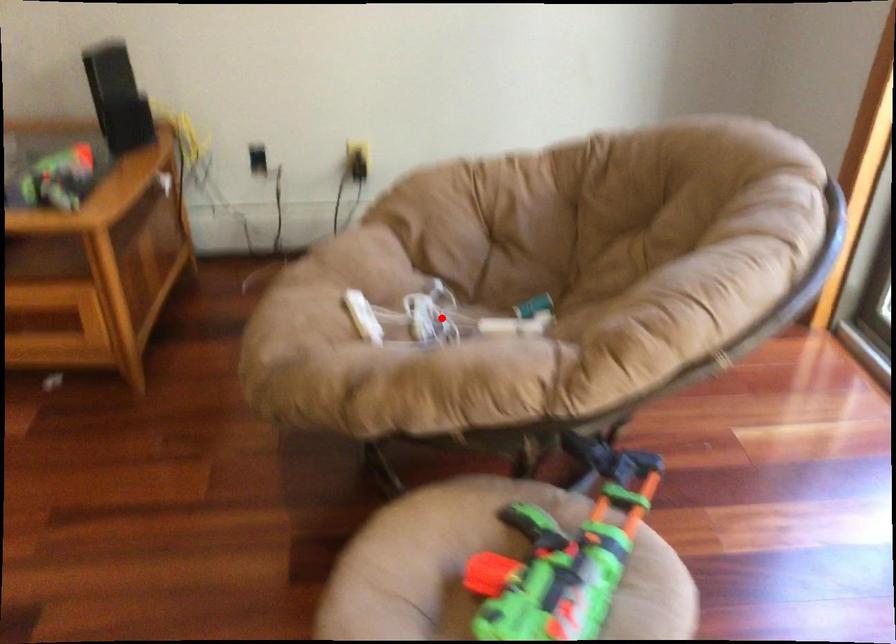
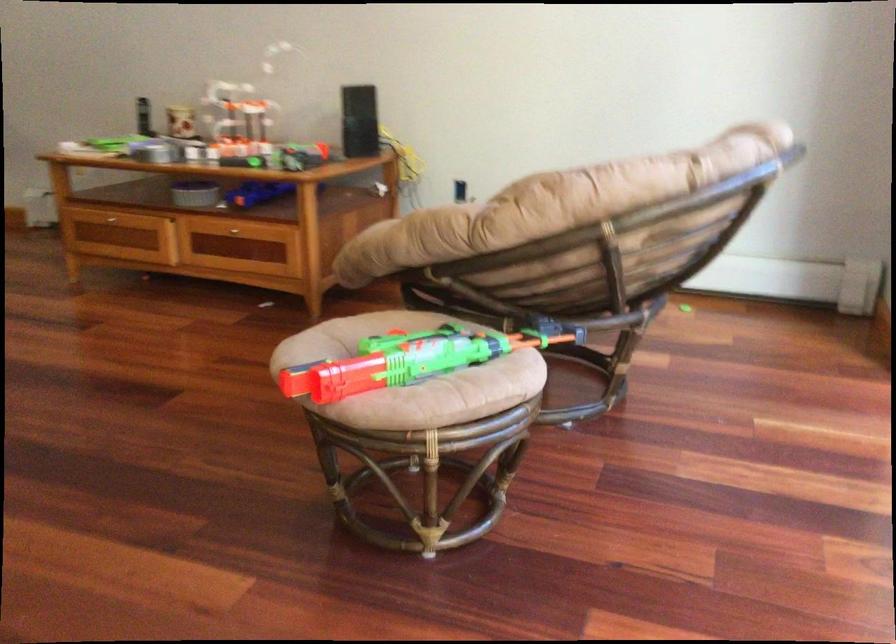
Question: I am providing you with two images of the same scene from different viewpoints. A red point is marked on the first image. Is the red point's position out of view in image 2?

Choices:
 (A) Yes
 (B) No

Answer: (A)